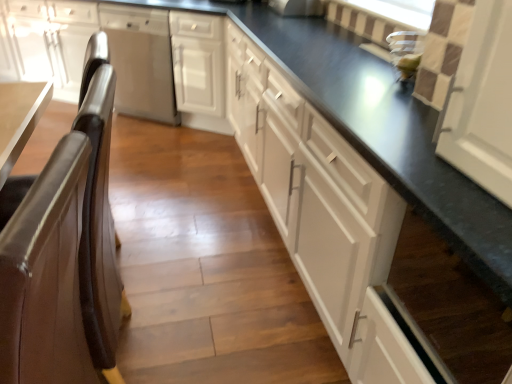
The image size is (512, 384). What are the coordinates of `vacant region to the right of brown leather chair at left` in the screenshot? It's located at (198, 336).